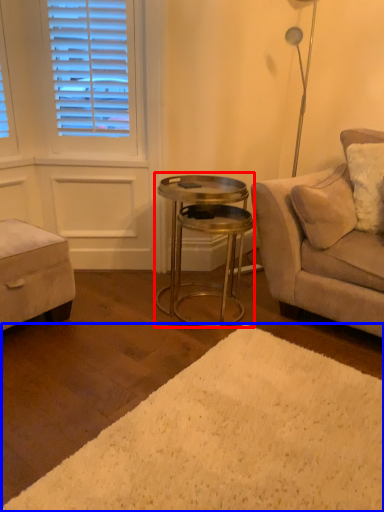
Question: Which of the following is the closest to the observer, table (highlighted by a red box) or plain (highlighted by a blue box)?

Choices:
 (A) table
 (B) plain

Answer: (B)